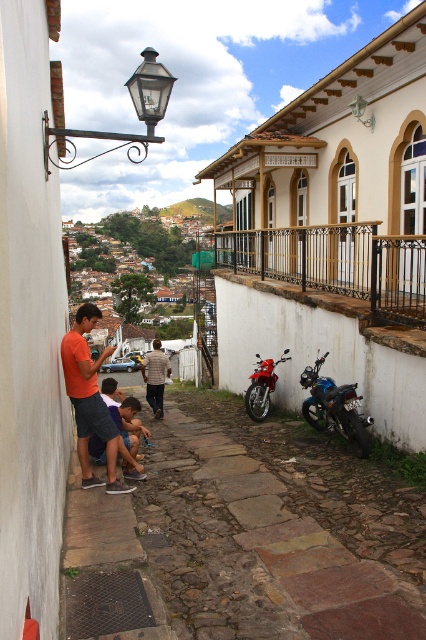
You are a tourist standing on the cobblestone pathway and see two people wearing an orange matte shirt at lower left and a light brown shirt at center. Which person is taller?

The orange matte shirt at lower left is much taller than the light brown shirt at center.

You are a tourist walking along the cobblestone pathway in the historic town. You notice the dark blue shorts at lower left and the shiny red motorcycle at center. Which object is smaller in size?

The dark blue shorts at lower left has a smaller size compared to the shiny red motorcycle at center, so the dark blue shorts at lower left is smaller.

You are a photographer standing at the camera position. You want to capture a photo of the orange matte shirt at lower left without moving the shirt. Can you adjust your camera position to get the shirt into the frame while staying within 7 meters from the shirt?

The orange matte shirt at lower left and camera are 6.81 meters apart, which is within the 7 meters limit. Therefore, you can adjust your camera position to capture the shirt without moving it, as the distance allows the shirt to be in the frame while staying within the 7 meters constraint.